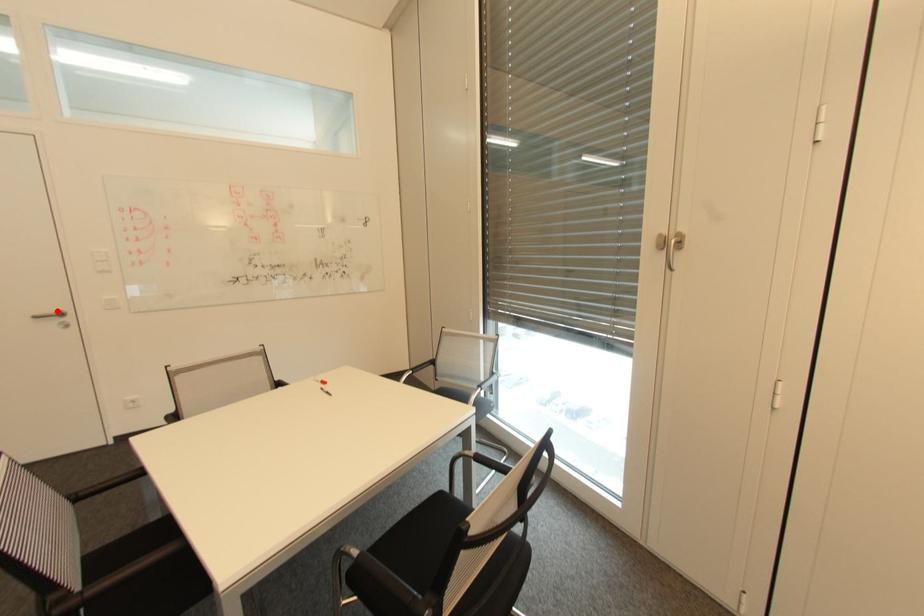
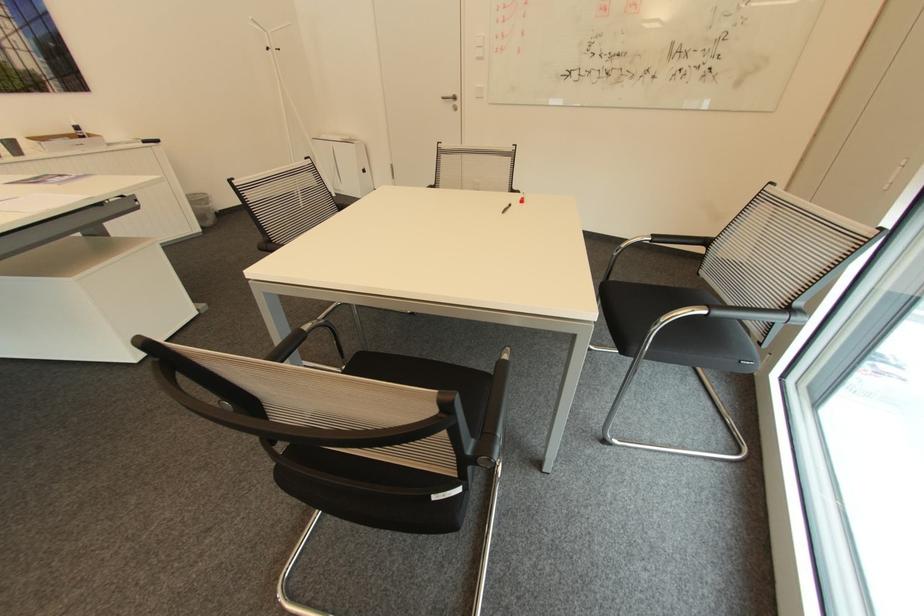
Question: I am providing you with two images of the same scene from different viewpoints. Given a red point in image1, look at the same physical point in image2. Is it:

Choices:
 (A) Closer to the viewpoint
 (B) Farther from the viewpoint

Answer: (A)